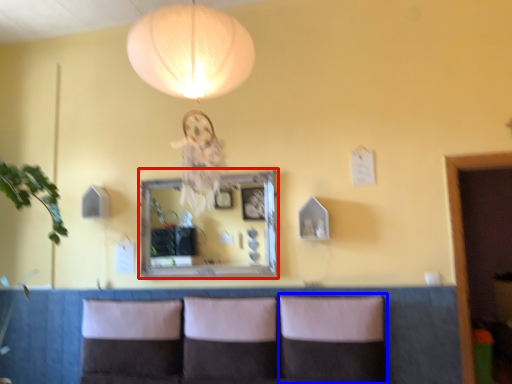
Question: Which object appears closest to the camera in this image, mirror (highlighted by a red box) or pillow (highlighted by a blue box)?

Choices:
 (A) mirror
 (B) pillow

Answer: (B)